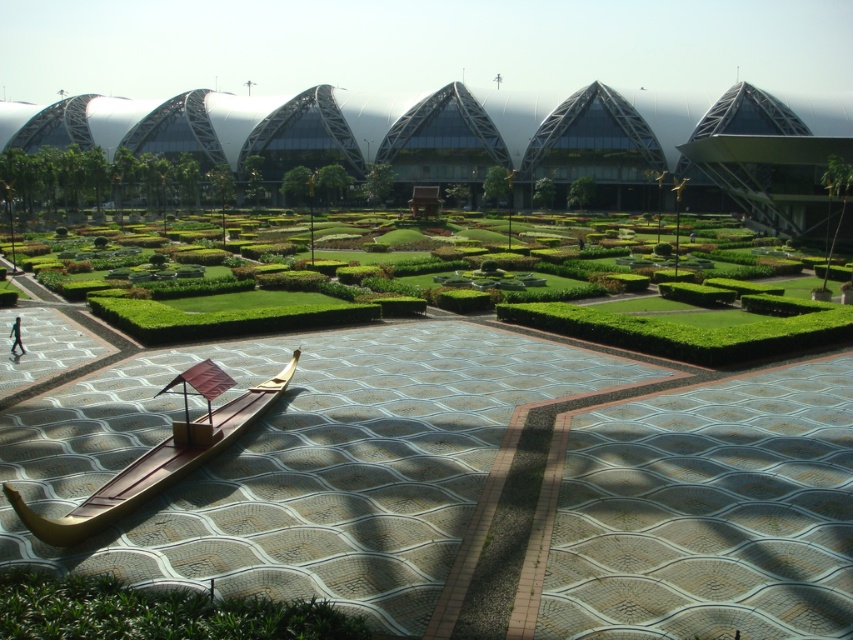
Question: Among these objects, which one is nearest to the camera?

Choices:
 (A) wooden boat at lower left
 (B) green leafy hedge at lower left
 (C) skinny person at center

Answer: (B)

Question: Can you confirm if green leafy hedge at lower left is wider than wooden boat at lower left?

Choices:
 (A) yes
 (B) no

Answer: (A)

Question: Which point is farther to the camera?

Choices:
 (A) wooden boat at lower left
 (B) green leafy hedge at lower left

Answer: (A)

Question: Can you confirm if wooden boat at lower left is positioned to the left of skinny person at center?

Choices:
 (A) yes
 (B) no

Answer: (B)

Question: Is green leafy hedge at lower left above wooden boat at lower left?

Choices:
 (A) no
 (B) yes

Answer: (A)

Question: Estimate the real-world distances between objects in this image. Which object is farther from the green leafy hedge at lower left?

Choices:
 (A) skinny person at center
 (B) wooden boat at lower left

Answer: (A)